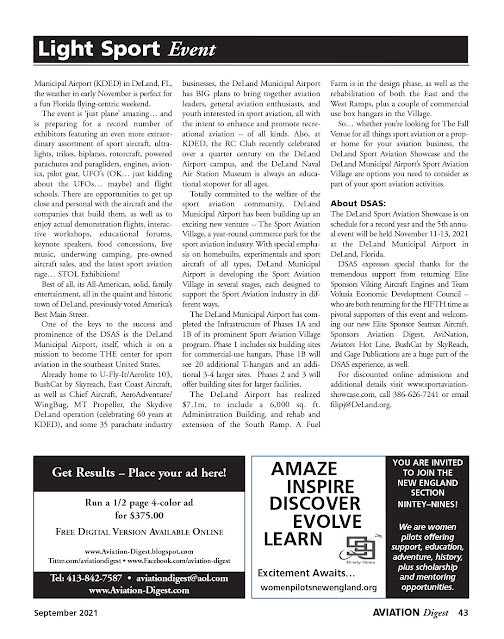
Locate an element on the screen. The image size is (504, 639). light is located at coordinates (63, 49).